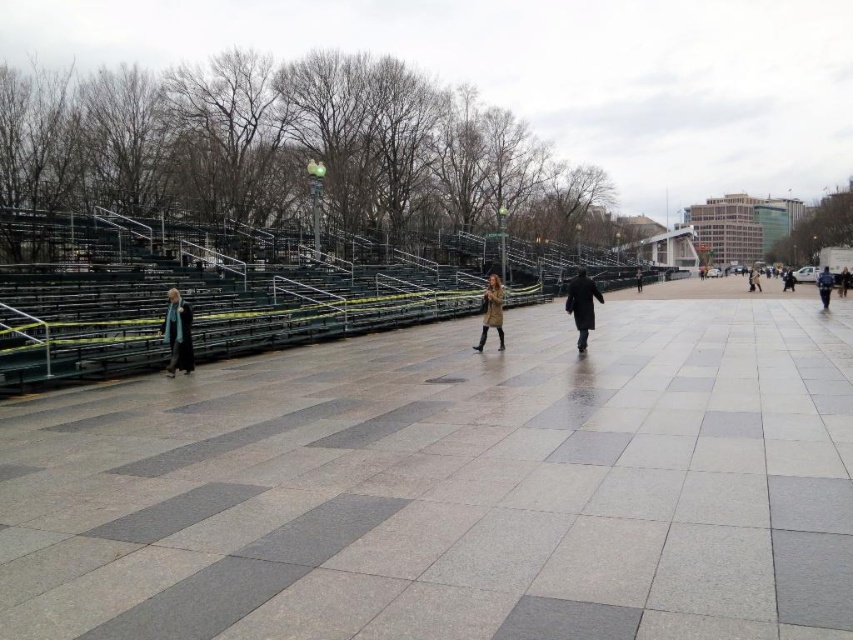
Is point (578, 333) positioned after point (637, 275)?

No.

Is dark matte coat at center bigger than dark brown leather coat at center?

Correct, dark matte coat at center is larger in size than dark brown leather coat at center.

I want to click on dark matte coat at center, so (582, 305).

Is point (625, 470) closer to viewer compared to point (485, 314)?

Yes, point (625, 470) is in front of point (485, 314).

Which is in front, point (271, 554) or point (486, 314)?

Point (271, 554) is more forward.

Is point (218, 490) farther from camera compared to point (503, 340)?

No, (218, 490) is closer to viewer.

Identify the location of gray concrete pavement at center. (454, 483).

Who is shorter, tan leather coat at center or dark brown leather jacket at right?

With less height is dark brown leather jacket at right.

Which is in front, point (480, 312) or point (846, 272)?

Point (480, 312) is more forward.

Between point (497, 326) and point (849, 280), which one is positioned behind?

Positioned behind is point (849, 280).

This screenshot has height=640, width=853. Find the location of `tan leather coat at center`. tan leather coat at center is located at coordinates click(491, 310).